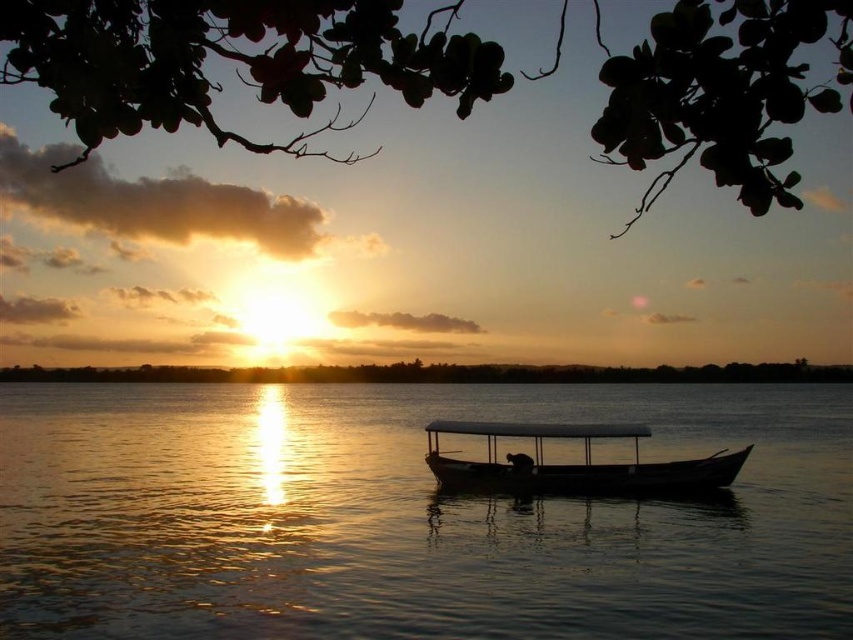
Does point (548, 417) lie in front of point (456, 484)?

No.

Does silvery reflective water at center have a smaller size compared to smooth wooden boat at center?

No, silvery reflective water at center is not smaller than smooth wooden boat at center.

Does point (248, 433) come closer to viewer compared to point (583, 445)?

No, it is behind (583, 445).

Find the location of `silvery reflective water at center`. silvery reflective water at center is located at coordinates (409, 516).